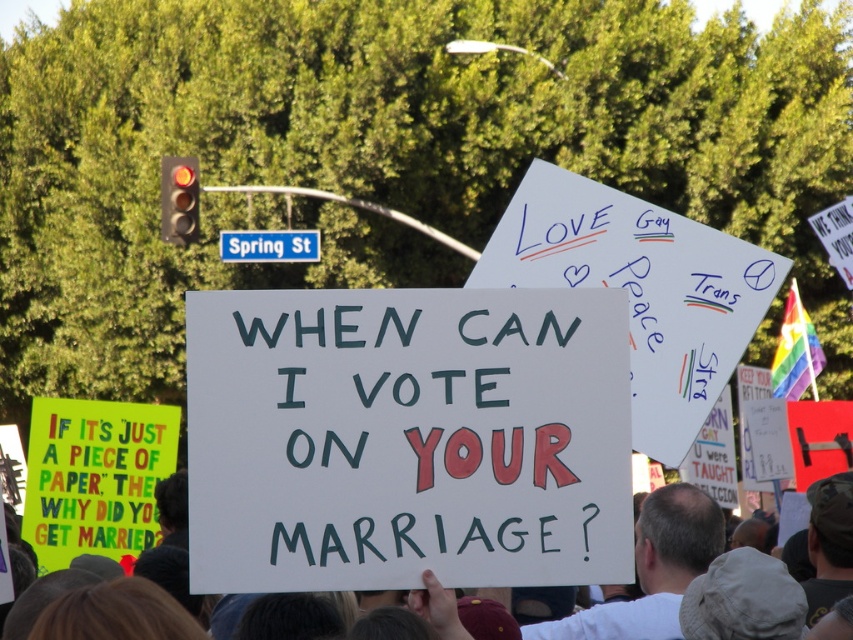
Does point (631, 609) lie in front of point (310, 241)?

Yes, point (631, 609) is in front of point (310, 241).

Between white paper sign at center and blue plastic street sign at upper center, which one is positioned lower?

white paper sign at center is below.

Measure the distance between white paper sign at center and camera.

The distance of white paper sign at center from camera is 21.54 feet.

Locate an element on the screen. This screenshot has height=640, width=853. white paper sign at center is located at coordinates (833, 525).